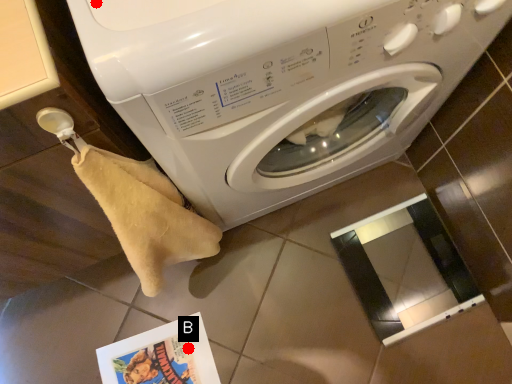
Question: Two points are circled on the image, labeled by A and B beside each circle. Which point is farther from the camera taking this photo?

Choices:
 (A) A is further
 (B) B is further

Answer: (B)